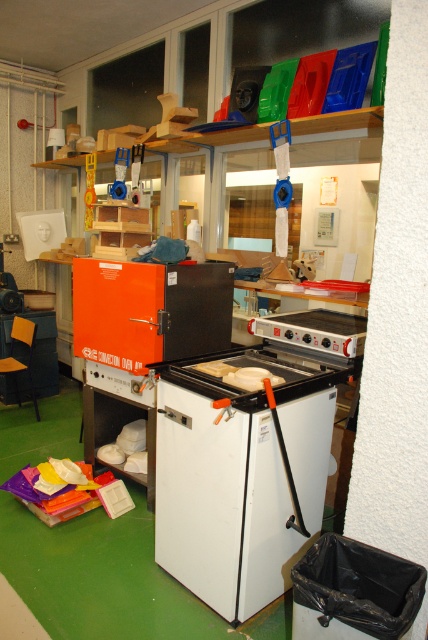
Find the location of a particular element. The width and height of the screenshot is (428, 640). white matte refrigerator at center is located at coordinates (240, 474).

Does white matte refrigerator at center lie in front of orange matte oven at center?

That is True.

This screenshot has height=640, width=428. What do you see at coordinates (240, 474) in the screenshot?
I see `white matte refrigerator at center` at bounding box center [240, 474].

The width and height of the screenshot is (428, 640). What are the coordinates of `white matte refrigerator at center` in the screenshot? It's located at click(x=240, y=474).